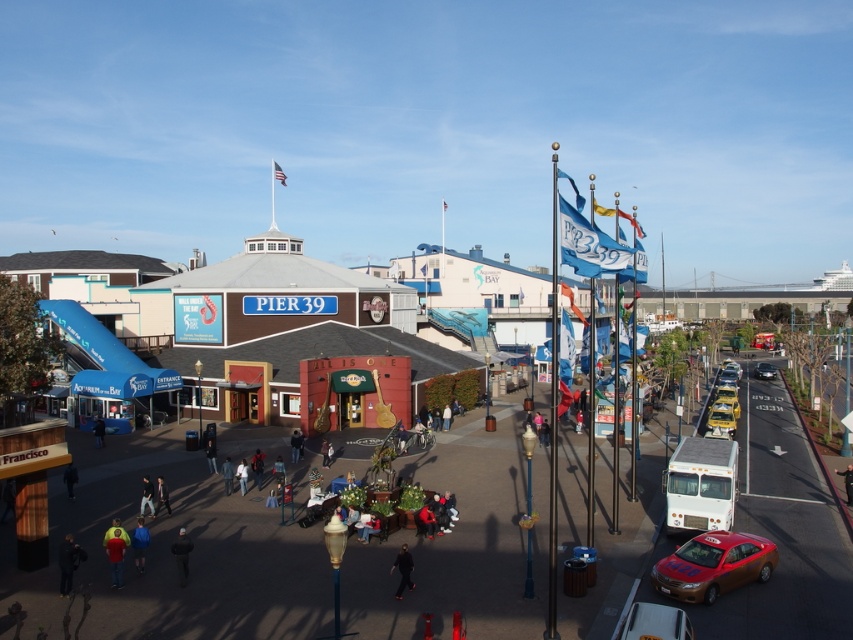
Consider the image. You are standing at the entrance of Pier 39 and see a black fabric jacket at lower left and a dark blue jacket at center. If you want to reach both jackets in the shortest distance possible, which jacket should you approach first?

The black fabric jacket at lower left is closer to you since it is only 29.17 feet away from the dark blue jacket at center, so approaching the black fabric jacket at lower left first would allow you to reach both jackets with the shortest total distance.

You are a tourist standing in the plaza at Pier 39. You notice two jackets hanging on a rack nearby. One is a black fabric jacket at lower left and the other is a dark blue jacket at center. Which jacket is closer to your right side?

The black fabric jacket at lower left is positioned on the right side of dark blue jacket at center, so the black fabric jacket at lower left is closer to your right side.